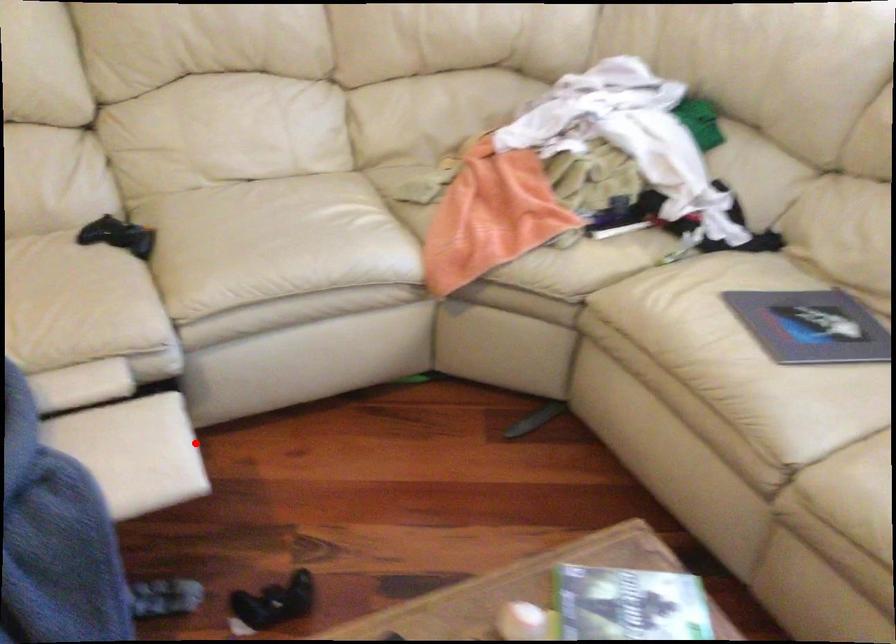
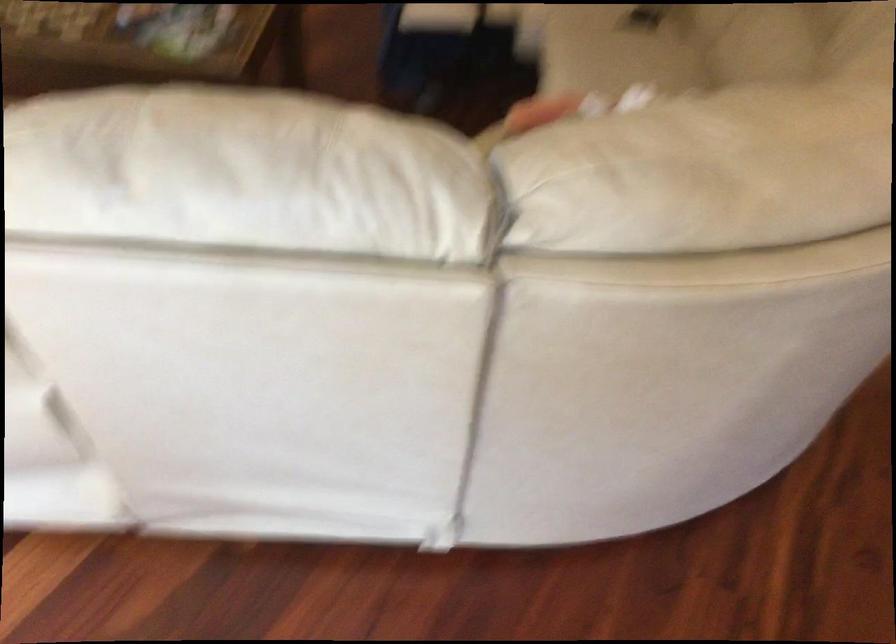
Find the pixel in the second image that matches the highlighted location in the first image.

(437, 17)